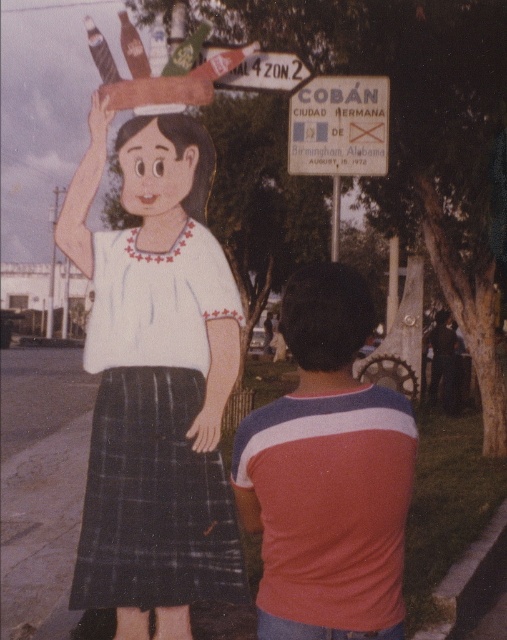
Question: Considering the relative positions of dark brown hair at center and smooth white head at center in the image provided, where is dark brown hair at center located with respect to smooth white head at center?

Choices:
 (A) below
 (B) above

Answer: (A)

Question: Which point is farther from the camera taking this photo?

Choices:
 (A) (284, 333)
 (B) (308, 99)
 (C) (238, 77)
 (D) (184, 204)

Answer: (B)

Question: Is matte white blouse at center to the right of plaid wool skirt at center from the viewer's perspective?

Choices:
 (A) no
 (B) yes

Answer: (A)

Question: From the image, what is the correct spatial relationship of matte white blouse at center in relation to striped cotton shirt at center?

Choices:
 (A) left
 (B) right

Answer: (A)

Question: Which of these objects is positioned closest to the white plastic sign at upper center?

Choices:
 (A) dark brown hair at center
 (B) matte white blouse at center
 (C) smooth white head at center
 (D) striped cotton shirt at center

Answer: (B)

Question: Which object is closer to the camera taking this photo?

Choices:
 (A) plaid wool skirt at center
 (B) metallic silver sign at upper center
 (C) white plastic sign at upper center
 (D) matte white blouse at center

Answer: (A)